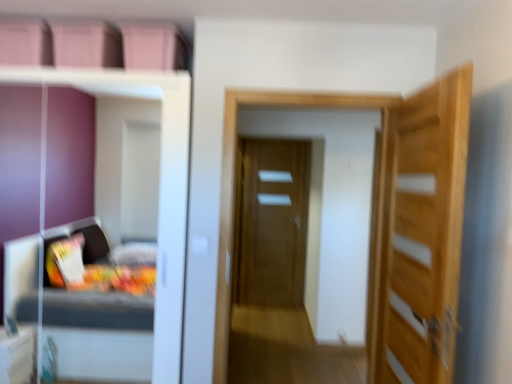
Measure the distance between matte wooden door at center, the 1th door positioned from the back, and camera.

The distance of matte wooden door at center, the 1th door positioned from the back, from camera is 5.08 meters.

Describe the element at coordinates (159, 186) in the screenshot. I see `white glossy dresser at left` at that location.

Find the location of a particular element. Image resolution: width=512 pixels, height=384 pixels. transparent glass door at center is located at coordinates (234, 185).

Where is `matte wooden door at center, the 1th door positioned from the back`? The image size is (512, 384). matte wooden door at center, the 1th door positioned from the back is located at coordinates (271, 222).

From a real-world perspective, is transparent glass door at center below light wood door at right, arranged as the 1th door when viewed from the right?

Yes, from a real-world perspective, transparent glass door at center is beneath light wood door at right, arranged as the 1th door when viewed from the right.

In terms of width, does transparent glass door at center look wider or thinner when compared to light wood door at right, which is counted as the second door, starting from the left?

Considering their sizes, transparent glass door at center looks broader than light wood door at right, which is counted as the second door, starting from the left.

From the image's perspective, which one is positioned higher, transparent glass door at center or light wood door at right, which is counted as the second door, starting from the left?

transparent glass door at center appears higher in the image.

Can you confirm if transparent glass door at center is bigger than light wood door at right, the 1th door from the front?

Indeed, transparent glass door at center has a larger size compared to light wood door at right, the 1th door from the front.

Is matte wooden door at center, the 1th door positioned from the back, in front of or behind light wood door at right, the 1th door from the front, in the image?

matte wooden door at center, the 1th door positioned from the back, is behind light wood door at right, the 1th door from the front.

From the picture: Between matte wooden door at center, which ranks as the second door in right-to-left order, and light wood door at right, which is counted as the second door, starting from the back, which one has larger width?

matte wooden door at center, which ranks as the second door in right-to-left order, is wider.

Considering the sizes of matte wooden door at center, arranged as the first door when viewed from the left, and light wood door at right, the 1th door from the front, in the image, is matte wooden door at center, arranged as the first door when viewed from the left, bigger or smaller than light wood door at right, the 1th door from the front,?

Clearly, matte wooden door at center, arranged as the first door when viewed from the left, is larger in size than light wood door at right, the 1th door from the front.

From the image's perspective, which is below, matte wooden door at center, which ranks as the second door in front-to-back order, or light wood door at right, which is counted as the second door, starting from the back?

matte wooden door at center, which ranks as the second door in front-to-back order.

From the image's perspective, is transparent glass door at center positioned above or below white glossy dresser at left?

transparent glass door at center is situated lower than white glossy dresser at left in the image.

Between transparent glass door at center and white glossy dresser at left, which one is positioned behind?

transparent glass door at center is more distant.

Do you think transparent glass door at center is within white glossy dresser at left, or outside of it?

transparent glass door at center is outside white glossy dresser at left.

Find the location of a particular element. This screenshot has height=384, width=512. dresser that appears on the left of transparent glass door at center is located at coordinates (159, 186).

Is light wood door at right, arranged as the 1th door when viewed from the right, smaller than white glossy dresser at left?

Yes, light wood door at right, arranged as the 1th door when viewed from the right, is smaller than white glossy dresser at left.

Does light wood door at right, which is counted as the second door, starting from the left, have a greater width compared to white glossy dresser at left?

Incorrect, the width of light wood door at right, which is counted as the second door, starting from the left, does not surpass that of white glossy dresser at left.

Who is taller, light wood door at right, arranged as the 1th door when viewed from the right, or white glossy dresser at left?

white glossy dresser at left.

Does light wood door at right, which is counted as the second door, starting from the left, turn towards white glossy dresser at left?

Yes, light wood door at right, which is counted as the second door, starting from the left, is facing white glossy dresser at left.

What are the coordinates of `door below the white glossy dresser at left (from a real-world perspective)` in the screenshot? It's located at (271, 222).

Considering the positions of points (266, 305) and (42, 122), is point (266, 305) closer to camera compared to point (42, 122)?

No, (266, 305) is behind (42, 122).

From the image's perspective, between matte wooden door at center, which ranks as the second door in right-to-left order, and white glossy dresser at left, who is located below?

matte wooden door at center, which ranks as the second door in right-to-left order, appears lower in the image.

From a real-world perspective, is matte wooden door at center, which ranks as the second door in front-to-back order, positioned above or below white glossy dresser at left?

matte wooden door at center, which ranks as the second door in front-to-back order, is situated lower than white glossy dresser at left in the real world.

Considering the sizes of objects matte wooden door at center, which ranks as the second door in front-to-back order, and transparent glass door at center in the image provided, who is bigger, matte wooden door at center, which ranks as the second door in front-to-back order, or transparent glass door at center?

With larger size is transparent glass door at center.

Is matte wooden door at center, the 1th door positioned from the back, placed right next to transparent glass door at center?

matte wooden door at center, the 1th door positioned from the back, and transparent glass door at center are not in contact.

From a real-world perspective, is matte wooden door at center, which ranks as the second door in right-to-left order, physically below transparent glass door at center?

Yes, from a real-world perspective, matte wooden door at center, which ranks as the second door in right-to-left order, is beneath transparent glass door at center.

From the image's perspective, is white glossy dresser at left under transparent glass door at center?

No, from the image's perspective, white glossy dresser at left is not beneath transparent glass door at center.

Find the location of `dresser below the transparent glass door at center (from a real-world perspective)`. dresser below the transparent glass door at center (from a real-world perspective) is located at coordinates (159, 186).

Relative to transparent glass door at center, is white glossy dresser at left in front or behind?

white glossy dresser at left is positioned closer to the viewer than transparent glass door at center.

Can you confirm if white glossy dresser at left is positioned to the right of transparent glass door at center?

No, white glossy dresser at left is not to the right of transparent glass door at center.

The image size is (512, 384). I want to click on screen door on the left of light wood door at right, which is counted as the second door, starting from the back, so click(x=234, y=185).

The width and height of the screenshot is (512, 384). I want to click on door on the right of matte wooden door at center, arranged as the first door when viewed from the left, so click(418, 233).

When comparing their distances from white glossy dresser at left, does matte wooden door at center, the 1th door positioned from the back, or transparent glass door at center seem closer?

transparent glass door at center.

Which object lies further to the anchor point matte wooden door at center, which ranks as the second door in front-to-back order, transparent glass door at center or light wood door at right, arranged as the 1th door when viewed from the right?

light wood door at right, arranged as the 1th door when viewed from the right, is further to matte wooden door at center, which ranks as the second door in front-to-back order.

From the image, which object appears to be nearer to matte wooden door at center, arranged as the first door when viewed from the left, white glossy dresser at left or light wood door at right, which is counted as the second door, starting from the left?

white glossy dresser at left lies closer to matte wooden door at center, arranged as the first door when viewed from the left, than the other object.

From the image, which object appears to be farther from transparent glass door at center, matte wooden door at center, which ranks as the second door in front-to-back order, or light wood door at right, which is counted as the second door, starting from the left?

matte wooden door at center, which ranks as the second door in front-to-back order, is positioned further to the anchor transparent glass door at center.

Which object lies nearer to the anchor point transparent glass door at center, light wood door at right, which is counted as the second door, starting from the left, or white glossy dresser at left?

light wood door at right, which is counted as the second door, starting from the left, is closer to transparent glass door at center.

Looking at the image, which one is located closer to white glossy dresser at left, transparent glass door at center or matte wooden door at center, the 1th door positioned from the back?

transparent glass door at center.

Considering their positions, is matte wooden door at center, arranged as the first door when viewed from the left, positioned further to transparent glass door at center than white glossy dresser at left?

matte wooden door at center, arranged as the first door when viewed from the left.

Looking at this image, looking at the image, which one is located further to transparent glass door at center, white glossy dresser at left or matte wooden door at center, which ranks as the second door in front-to-back order?

matte wooden door at center, which ranks as the second door in front-to-back order, is positioned further to the anchor transparent glass door at center.

Locate an element on the screen. This screenshot has width=512, height=384. screen door located between white glossy dresser at left and matte wooden door at center, arranged as the first door when viewed from the left, in the depth direction is located at coordinates tap(234, 185).

At what (x,y) coordinates should I click in order to perform the action: click on screen door located between white glossy dresser at left and light wood door at right, which is counted as the second door, starting from the left, in the left-right direction. Please return your answer as a coordinate pair (x, y). This screenshot has width=512, height=384. Looking at the image, I should click on (234, 185).

The image size is (512, 384). Find the location of `screen door between light wood door at right, which is counted as the second door, starting from the left, and matte wooden door at center, the 1th door positioned from the back, in the front-back direction`. screen door between light wood door at right, which is counted as the second door, starting from the left, and matte wooden door at center, the 1th door positioned from the back, in the front-back direction is located at coordinates (234, 185).

Locate an element on the screen. dresser positioned between light wood door at right, which is counted as the second door, starting from the back, and matte wooden door at center, which ranks as the second door in front-to-back order, from near to far is located at coordinates (159, 186).